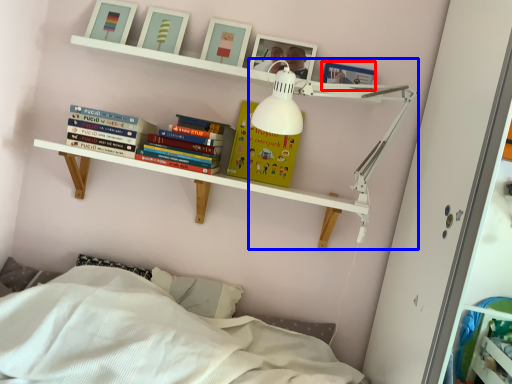
Question: Which of the following is the farthest to the observer, picture frame (highlighted by a red box) or lamp (highlighted by a blue box)?

Choices:
 (A) picture frame
 (B) lamp

Answer: (A)